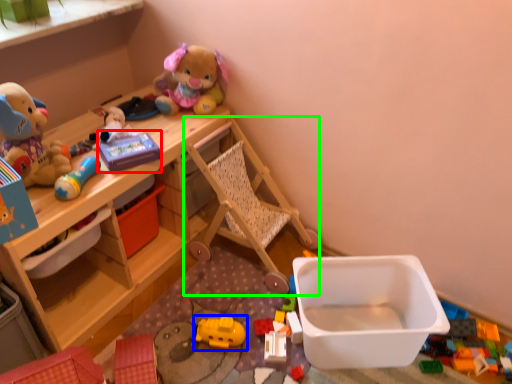
Question: Which object is the farthest from toy (highlighted by a red box)? Choose among these: toy (highlighted by a blue box) or baby carriage (highlighted by a green box).

Choices:
 (A) toy
 (B) baby carriage

Answer: (A)